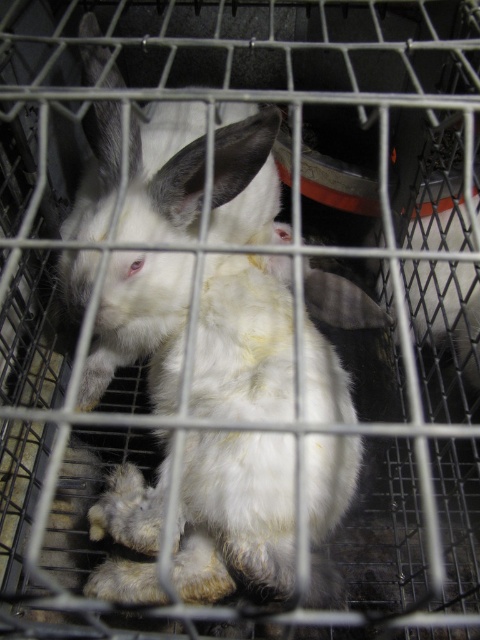
Question: From the image, what is the correct spatial relationship of white fluffy rabbit at center in relation to white fur rabbit at center?

Choices:
 (A) left
 (B) right

Answer: (A)

Question: Is the position of white fluffy rabbit at center more distant than that of white fur rabbit at center?

Choices:
 (A) yes
 (B) no

Answer: (B)

Question: Can you confirm if white fluffy rabbit at center is positioned to the right of white fur rabbit at center?

Choices:
 (A) yes
 (B) no

Answer: (B)